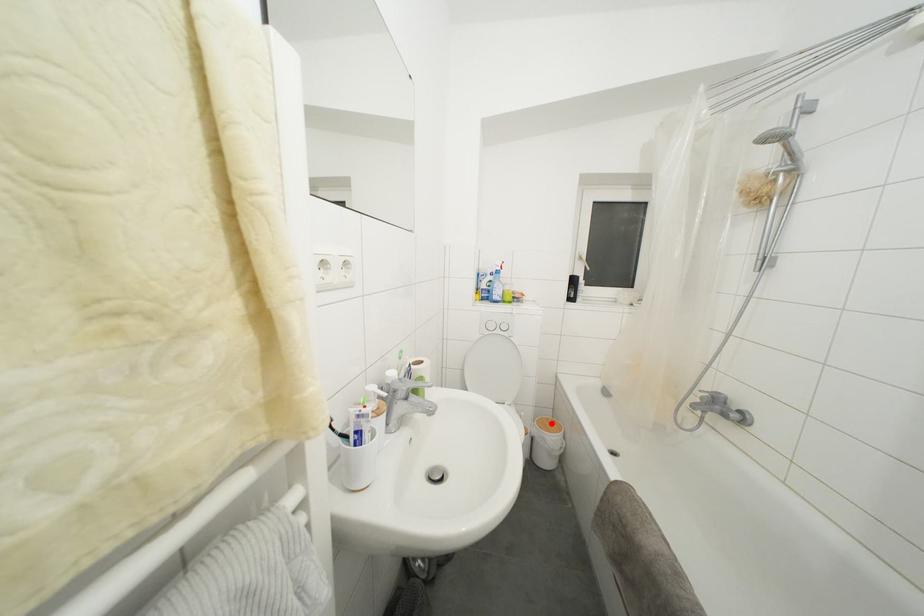
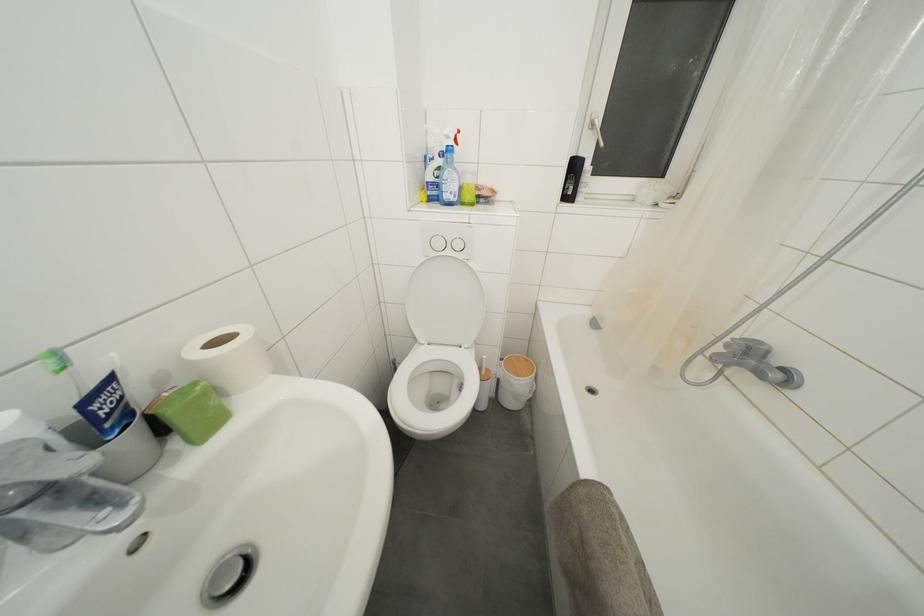
Question: I am providing you with two images of the same scene from different viewpoints. A red point is shown in image1. For the corresponding object point in image2, is it positioned nearer or farther from the camera?

Choices:
 (A) Nearer
 (B) Farther

Answer: (A)